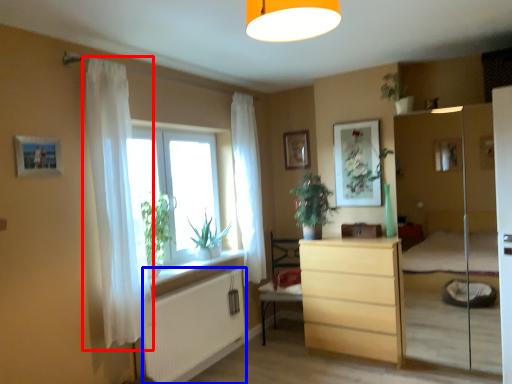
Question: Which point is closer to the camera, curtain (highlighted by a red box) or radiator (highlighted by a blue box)?

Choices:
 (A) curtain
 (B) radiator

Answer: (A)